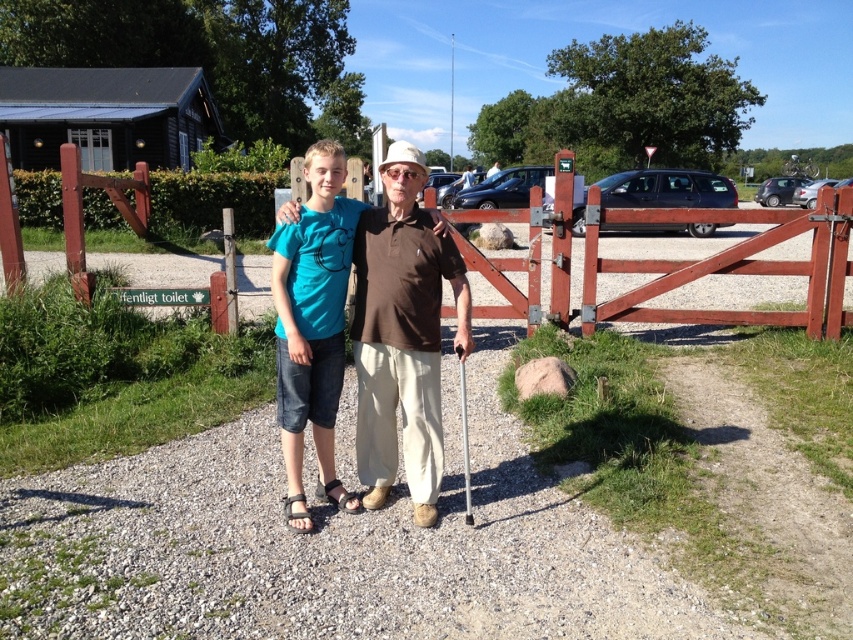
Which is below, wooden gate at center or teal cotton t-shirt at center?

teal cotton t-shirt at center is lower down.

Does wooden gate at center appear over teal cotton t-shirt at center?

Yes, wooden gate at center is above teal cotton t-shirt at center.

Does point (637, 268) come closer to viewer compared to point (460, 285)?

That is False.

The width and height of the screenshot is (853, 640). What are the coordinates of `wooden gate at center` in the screenshot? It's located at click(x=732, y=266).